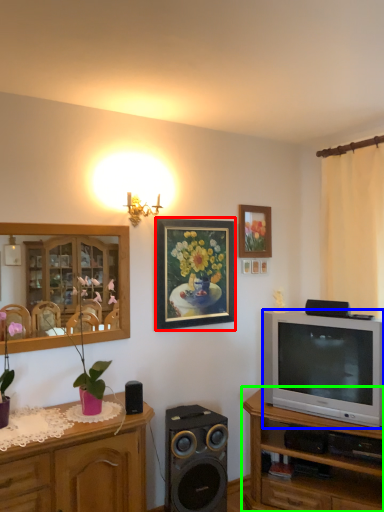
Question: Which object is the closest to the picture frame (highlighted by a red box)? Choose among these: television (highlighted by a blue box) or cabinetry (highlighted by a green box).

Choices:
 (A) television
 (B) cabinetry

Answer: (A)